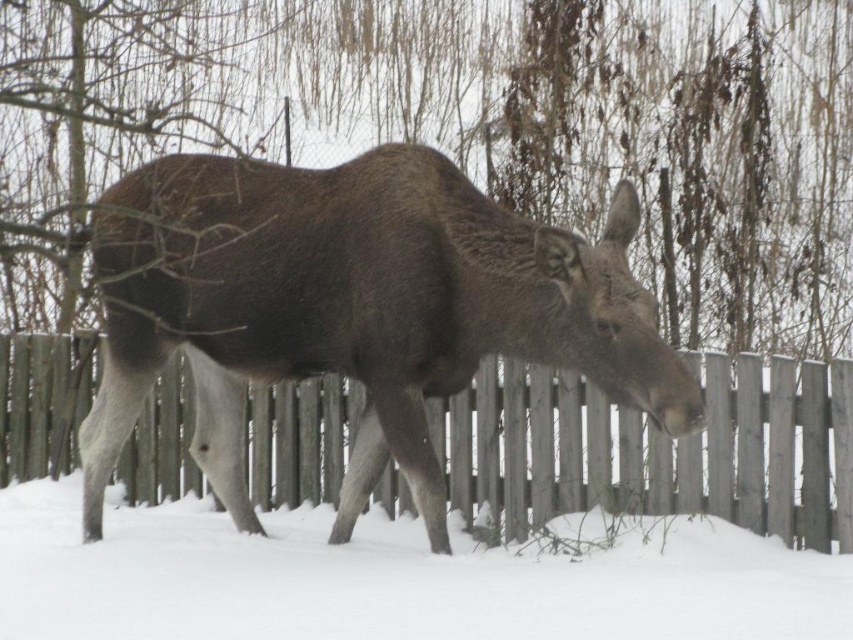
Can you confirm if brown furry deer at center is wider than white fluffy snow at lower center?

Correct, the width of brown furry deer at center exceeds that of white fluffy snow at lower center.

Consider the image. Is brown furry deer at center above white fluffy snow at lower center?

Indeed, brown furry deer at center is positioned over white fluffy snow at lower center.

Who is more forward, (631, 330) or (428, 624)?

Point (428, 624) is more forward.

You are a GUI agent. You are given a task and a screenshot of the screen. Output one action in this format:
    pyautogui.click(x=<x>, y=<y>)
    Task: Click on the brown furry deer at center
    The height and width of the screenshot is (640, 853).
    Given the screenshot: What is the action you would take?
    pyautogui.click(x=364, y=310)

From the picture: Can you confirm if white fluffy snow at lower center is wider than wooden fence at center?

No.

Is point (531, 600) farther from camera compared to point (654, 480)?

That is False.

At what (x,y) coordinates should I click in order to perform the action: click on white fluffy snow at lower center. Please return your answer as a coordinate pair (x, y). Looking at the image, I should click on (393, 579).

Is brown furry deer at center behind wooden fence at center?

That is False.

Does brown furry deer at center appear on the left side of wooden fence at center?

Yes, brown furry deer at center is to the left of wooden fence at center.

Who is more distant from viewer, (x=634, y=195) or (x=508, y=362)?

Point (x=508, y=362)

Identify the location of brown furry deer at center. This screenshot has height=640, width=853. (364, 310).